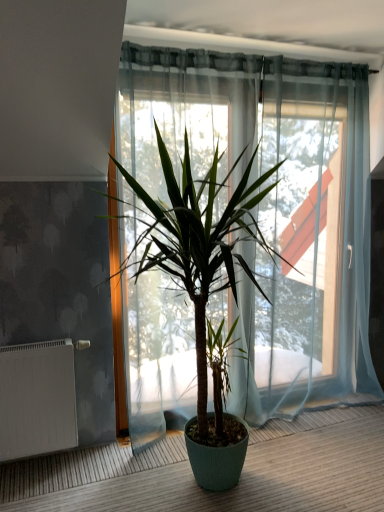
What do you see at coordinates (37, 399) in the screenshot? The width and height of the screenshot is (384, 512). I see `white matte radiator at lower left` at bounding box center [37, 399].

Where is `white matte radiator at lower left`? The height and width of the screenshot is (512, 384). white matte radiator at lower left is located at coordinates (37, 399).

Based on the photo, what is the approximate height of white matte radiator at lower left?

white matte radiator at lower left is 25.56 inches in height.

Image resolution: width=384 pixels, height=512 pixels. I want to click on green matte plant at center, so click(x=204, y=287).

What do you see at coordinates (204, 287) in the screenshot? The width and height of the screenshot is (384, 512). I see `green matte plant at center` at bounding box center [204, 287].

In order to face green matte plant at center, should I rotate leftwards or rightwards?

You should look right and rotate roughly 0.794 degrees.

Image resolution: width=384 pixels, height=512 pixels. I want to click on white matte radiator at lower left, so click(37, 399).

Considering the positions of objects white matte radiator at lower left and green matte plant at center in the image provided, who is more to the left, white matte radiator at lower left or green matte plant at center?

white matte radiator at lower left.

In the image, is white matte radiator at lower left positioned in front of or behind green matte plant at center?

In the image, white matte radiator at lower left appears behind green matte plant at center.

Which is behind, point (68, 389) or point (166, 217)?

The point (68, 389) is more distant.

From the image's perspective, which one is positioned higher, white matte radiator at lower left or green matte plant at center?

green matte plant at center.

From a real-world perspective, who is located higher, white matte radiator at lower left or green matte plant at center?

green matte plant at center.

Considering the relative sizes of white matte radiator at lower left and green matte plant at center in the image provided, is white matte radiator at lower left wider than green matte plant at center?

Incorrect, the width of white matte radiator at lower left does not surpass that of green matte plant at center.

Can you confirm if white matte radiator at lower left is shorter than green matte plant at center?

Correct, white matte radiator at lower left is not as tall as green matte plant at center.

Considering the sizes of objects white matte radiator at lower left and green matte plant at center in the image provided, who is smaller, white matte radiator at lower left or green matte plant at center?

white matte radiator at lower left.

Is white matte radiator at lower left not within green matte plant at center?

Indeed, white matte radiator at lower left is completely outside green matte plant at center.

Would you consider white matte radiator at lower left to be distant from green matte plant at center?

No, there isn't a large distance between white matte radiator at lower left and green matte plant at center.

Is green matte plant at center at the back of white matte radiator at lower left?

No, white matte radiator at lower left is not facing away from green matte plant at center.

How different are the orientations of white matte radiator at lower left and green matte plant at center in degrees?

They differ by 4.98 degrees in their facing directions.

Measure the distance between white matte radiator at lower left and green matte plant at center.

They are 33.19 inches apart.

Where is `houseplant in front of the white matte radiator at lower left`? The width and height of the screenshot is (384, 512). houseplant in front of the white matte radiator at lower left is located at coordinates click(204, 287).

Considering the relative positions of green matte plant at center and white matte radiator at lower left in the image provided, is green matte plant at center to the left or to the right of white matte radiator at lower left?

green matte plant at center is positioned on white matte radiator at lower left's right side.

In the image, is green matte plant at center positioned in front of or behind white matte radiator at lower left?

In the image, green matte plant at center appears in front of white matte radiator at lower left.

Is point (200, 484) closer or farther from the camera than point (67, 343)?

Clearly, point (200, 484) is closer to the camera than point (67, 343).

From the image's perspective, is green matte plant at center located above white matte radiator at lower left?

Yes, from the image's perspective, green matte plant at center is above white matte radiator at lower left.

Consider the image. From a real-world perspective, is green matte plant at center physically below white matte radiator at lower left?

No, from a real-world perspective, green matte plant at center is not below white matte radiator at lower left.

Between green matte plant at center and white matte radiator at lower left, which one has larger width?

Wider between the two is green matte plant at center.

Between green matte plant at center and white matte radiator at lower left, which one has less height?

Standing shorter between the two is white matte radiator at lower left.

In the scene shown: Considering the relative sizes of green matte plant at center and white matte radiator at lower left in the image provided, is green matte plant at center smaller than white matte radiator at lower left?

Incorrect, green matte plant at center is not smaller in size than white matte radiator at lower left.

Looking at this image, would you say green matte plant at center contains white matte radiator at lower left?

Definitely not — white matte radiator at lower left is not inside green matte plant at center.

Is the surface of green matte plant at center in direct contact with white matte radiator at lower left?

No, green matte plant at center is not touching white matte radiator at lower left.

Is green matte plant at center oriented towards white matte radiator at lower left?

No, green matte plant at center is not oriented towards white matte radiator at lower left.

How many degrees apart are the facing directions of green matte plant at center and white matte radiator at lower left?

4.98 degrees.

Locate an element on the screen. This screenshot has width=384, height=512. houseplant above the white matte radiator at lower left (from the image's perspective) is located at coordinates (204, 287).

What are the coordinates of `radiator behind the green matte plant at center` in the screenshot? It's located at (37, 399).

This screenshot has width=384, height=512. Find the location of `radiator that is below the green matte plant at center (from the image's perspective)`. radiator that is below the green matte plant at center (from the image's perspective) is located at coordinates (37, 399).